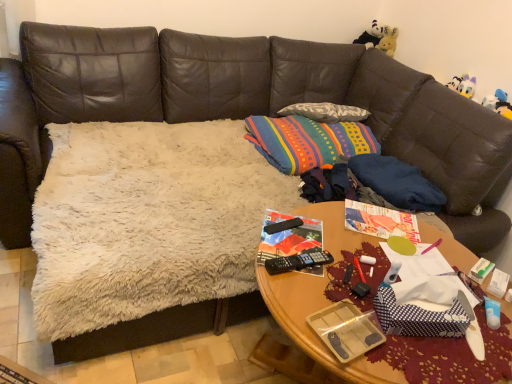
The height and width of the screenshot is (384, 512). I want to click on vacant area on top of woodenobject at center (from a real-world perspective), so click(x=371, y=282).